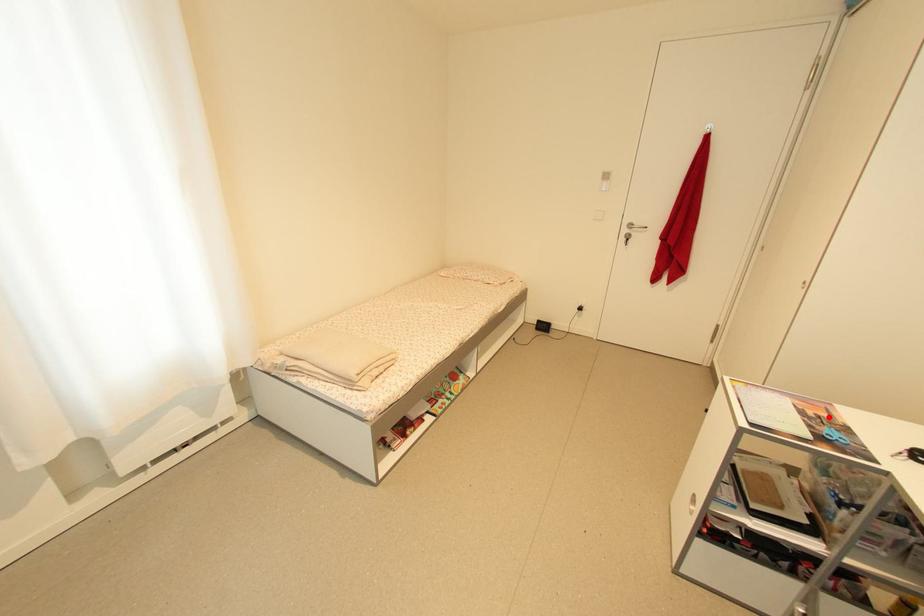
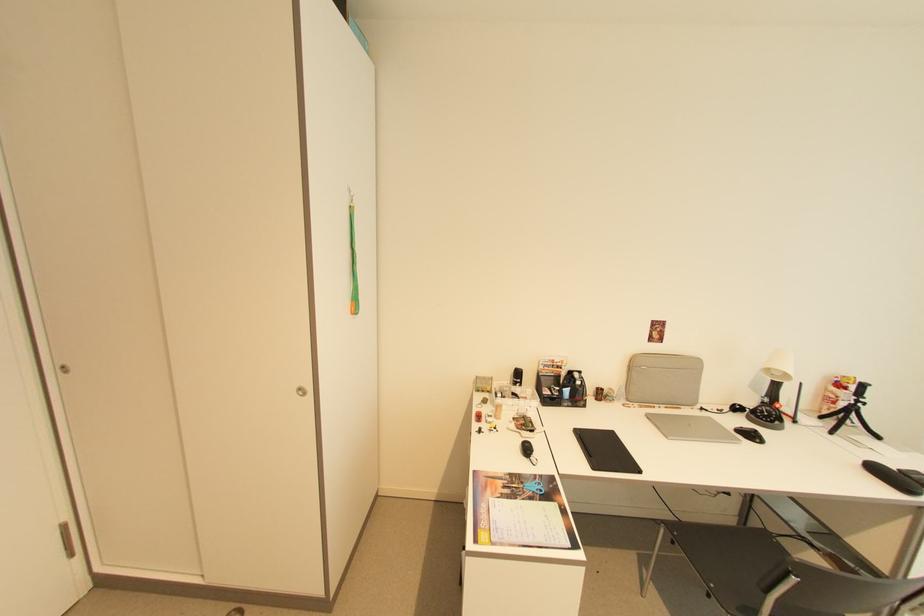
Find the pixel in the second image that matches the highlighted location in the first image.

(505, 484)